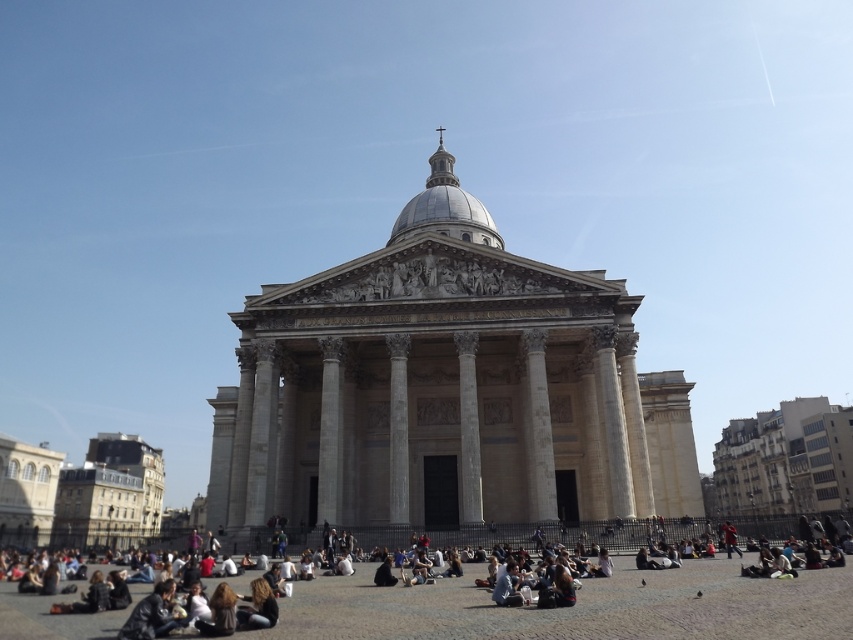
Question: Among these objects, which one is farthest from the camera?

Choices:
 (A) blonde hair at lower left
 (B) white marble building at center

Answer: (B)

Question: Is white marble building at center below dark brown hair at lower center?

Choices:
 (A) yes
 (B) no

Answer: (B)

Question: Which point is closer to the camera taking this photo?

Choices:
 (A) tap(260, 616)
 (B) tap(358, 611)
 (C) tap(469, 276)

Answer: (A)

Question: In this image, where is white marble building at center located relative to dark brown hair at lower center?

Choices:
 (A) right
 (B) left

Answer: (A)

Question: Can you confirm if dark gray stone people at lower center is positioned to the left of dark brown hair at lower center?

Choices:
 (A) no
 (B) yes

Answer: (A)

Question: Which object is positioned closest to the dark brown hair at lower center?

Choices:
 (A) blonde hair at lower left
 (B) white marble building at center
 (C) dark gray stone people at lower center

Answer: (A)